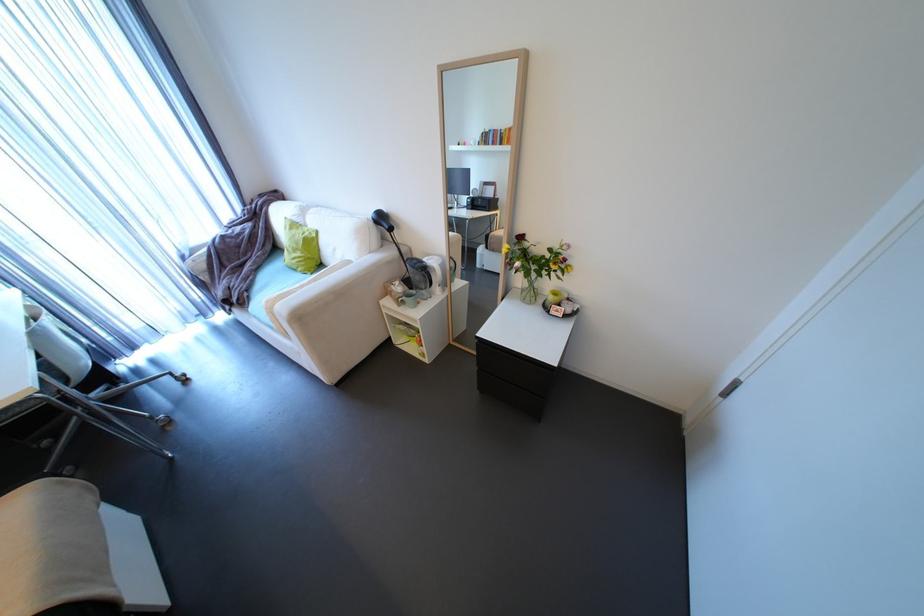
The image size is (924, 616). I want to click on sofa sitting surface, so click(x=272, y=280).